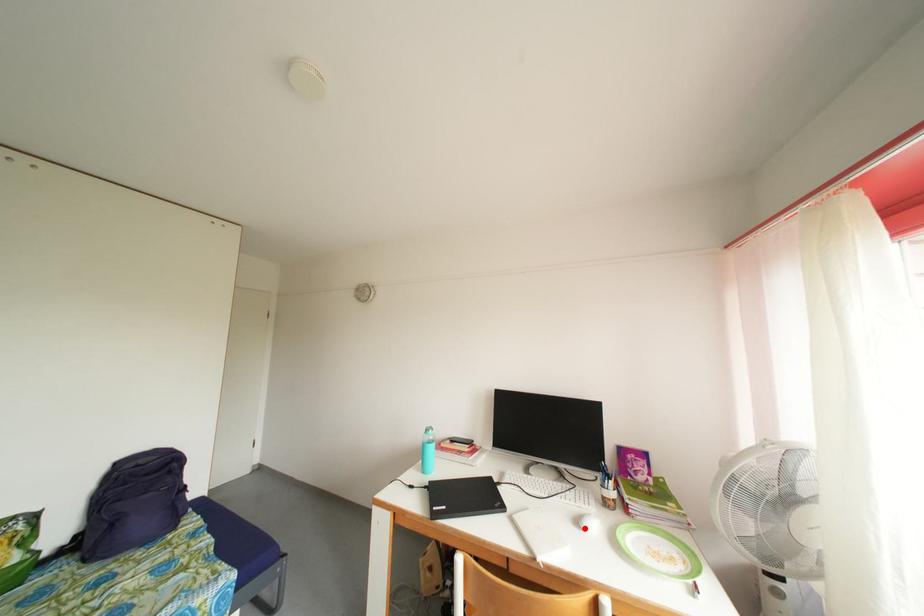
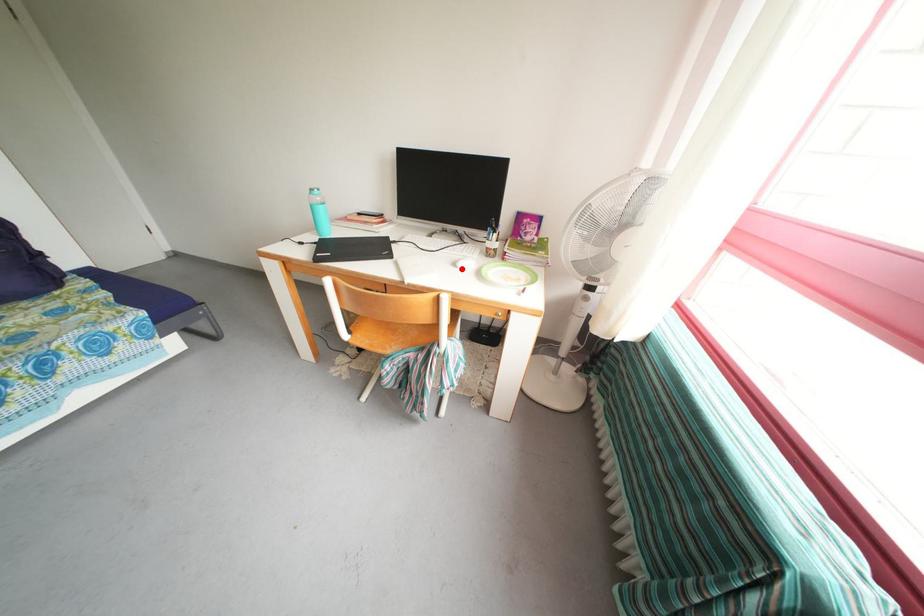
I am providing you with two images of the same scene from different viewpoints. A red point is marked on the first image and another point is marked on the second image. Is the red point in image1 aligned with the point shown in image2?

Yes